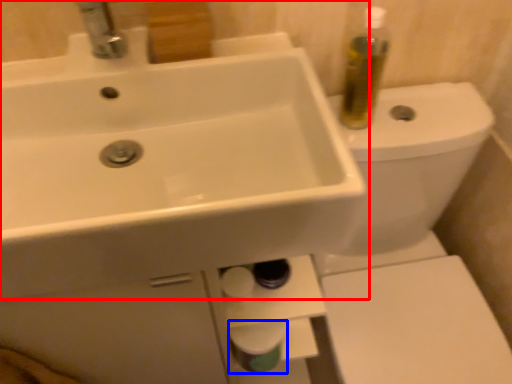
Question: Which point is further to the camera, sink (highlighted by a red box) or toilet paper (highlighted by a blue box)?

Choices:
 (A) sink
 (B) toilet paper

Answer: (B)